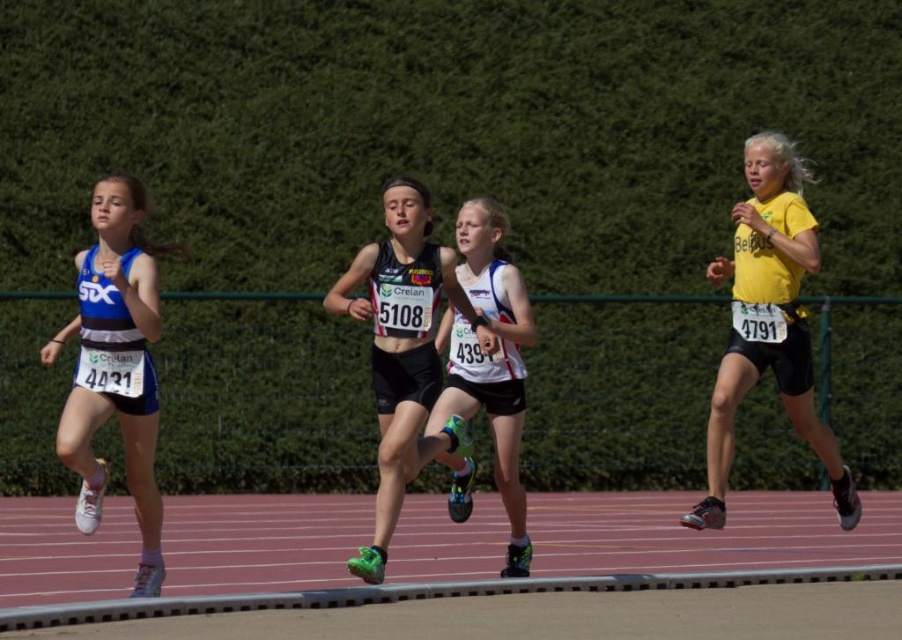
Question: Which of the following is the farthest from the observer?

Choices:
 (A) matte blue tank top at left
 (B) yellow matte shirt at right
 (C) black matte running shoe at center

Answer: (B)

Question: Which of the following is the closest to the observer?

Choices:
 (A) matte blue tank top at left
 (B) black matte running shoe at center
 (C) white matte tank top at center
 (D) yellow matte shirt at right

Answer: (A)

Question: Does yellow matte shirt at right appear on the left side of black matte running shoe at center?

Choices:
 (A) yes
 (B) no

Answer: (B)

Question: Does yellow matte shirt at right have a larger size compared to matte blue tank top at left?

Choices:
 (A) no
 (B) yes

Answer: (B)

Question: Can you confirm if matte blue tank top at left is thinner than white matte tank top at center?

Choices:
 (A) yes
 (B) no

Answer: (B)

Question: Which point appears farthest from the camera in this image?

Choices:
 (A) tap(120, 339)
 (B) tap(746, 292)

Answer: (B)